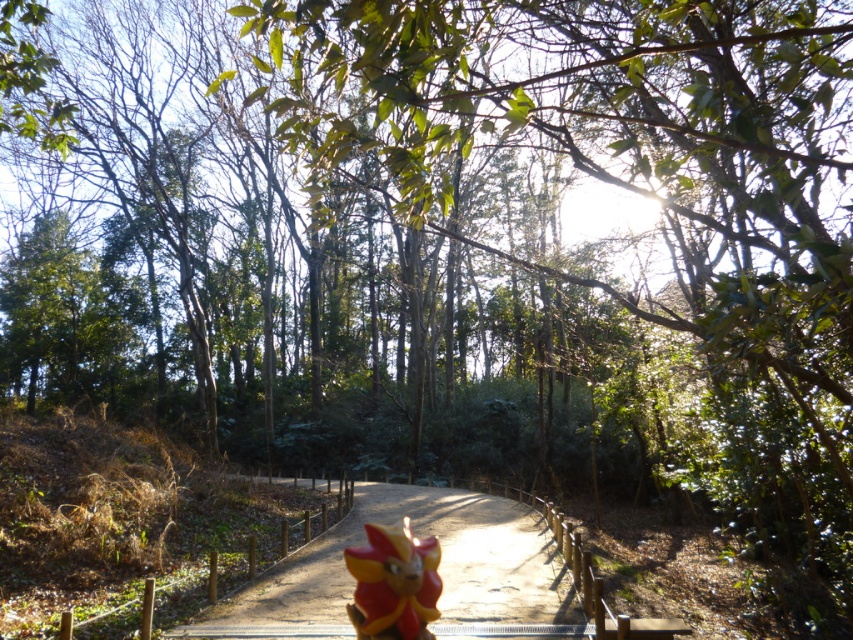
Question: Which point is farther to the camera?

Choices:
 (A) smooth wooden path at center
 (B) shiny red flower at center

Answer: (A)

Question: Is smooth wooden path at center wider than shiny red flower at center?

Choices:
 (A) no
 (B) yes

Answer: (B)

Question: Among these objects, which one is nearest to the camera?

Choices:
 (A) smooth wooden path at center
 (B) shiny red flower at center

Answer: (B)

Question: From the image, what is the correct spatial relationship of smooth wooden path at center in relation to shiny red flower at center?

Choices:
 (A) below
 (B) above

Answer: (A)

Question: Is smooth wooden path at center to the right of shiny red flower at center from the viewer's perspective?

Choices:
 (A) yes
 (B) no

Answer: (A)